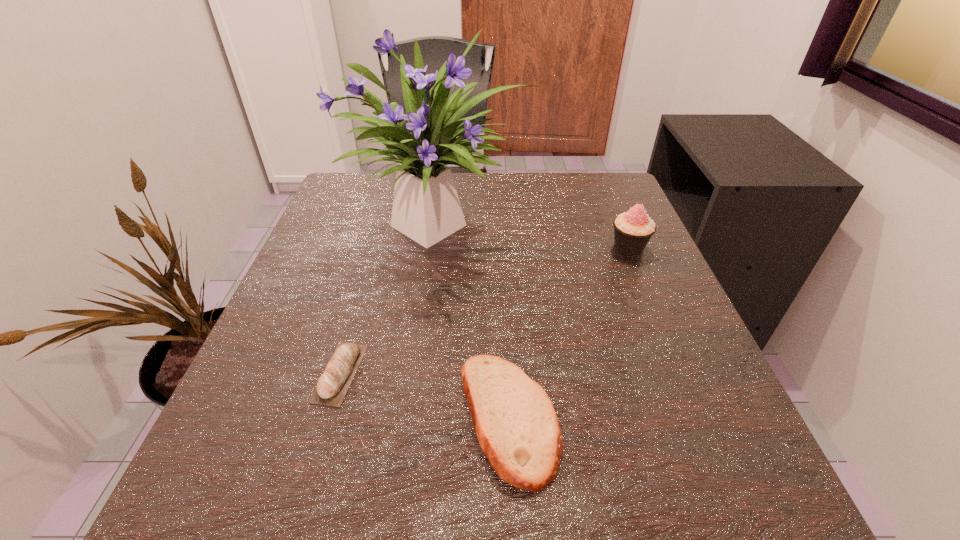
Where is `vacant area located on the front of the shorter pita bread`? The width and height of the screenshot is (960, 540). vacant area located on the front of the shorter pita bread is located at coordinates (321, 441).

Find the location of a particular element. object at the far edge is located at coordinates (426, 208).

This screenshot has width=960, height=540. Identify the location of object situated at the near edge. (518, 430).

This screenshot has width=960, height=540. I want to click on flower arrangement that is at the left edge, so (x=426, y=208).

In order to click on pita bread at the left edge in this screenshot , I will do `click(332, 386)`.

Locate an element on the screen. object at the right edge is located at coordinates (633, 229).

The height and width of the screenshot is (540, 960). Find the location of `object that is at the far left corner`. object that is at the far left corner is located at coordinates (426, 208).

This screenshot has width=960, height=540. What are the coordinates of `vacant space at the far edge of the desktop` in the screenshot? It's located at (514, 184).

The height and width of the screenshot is (540, 960). What are the coordinates of `blank space at the left edge of the desktop` in the screenshot? It's located at (324, 226).

Locate an element on the screen. Image resolution: width=960 pixels, height=540 pixels. blank space at the right edge is located at coordinates (669, 333).